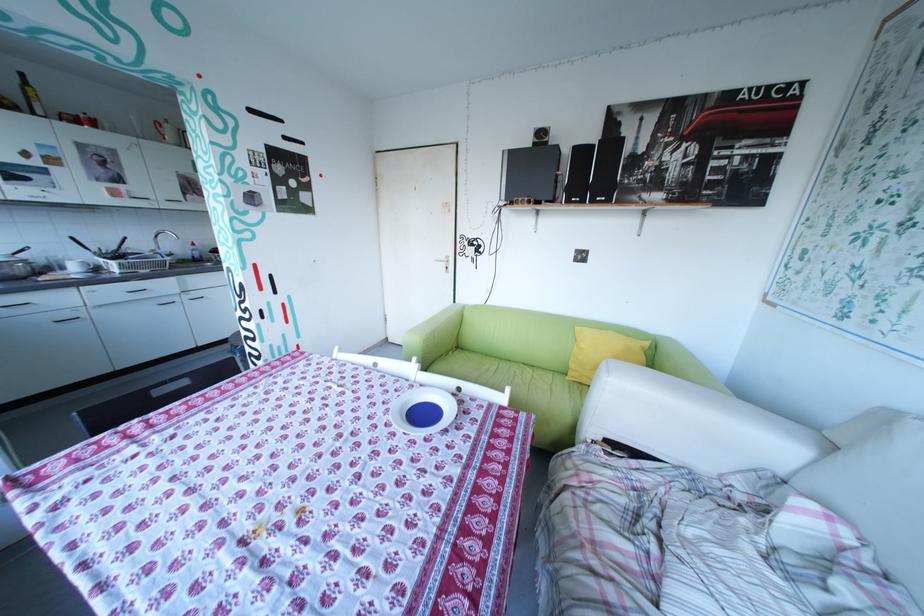
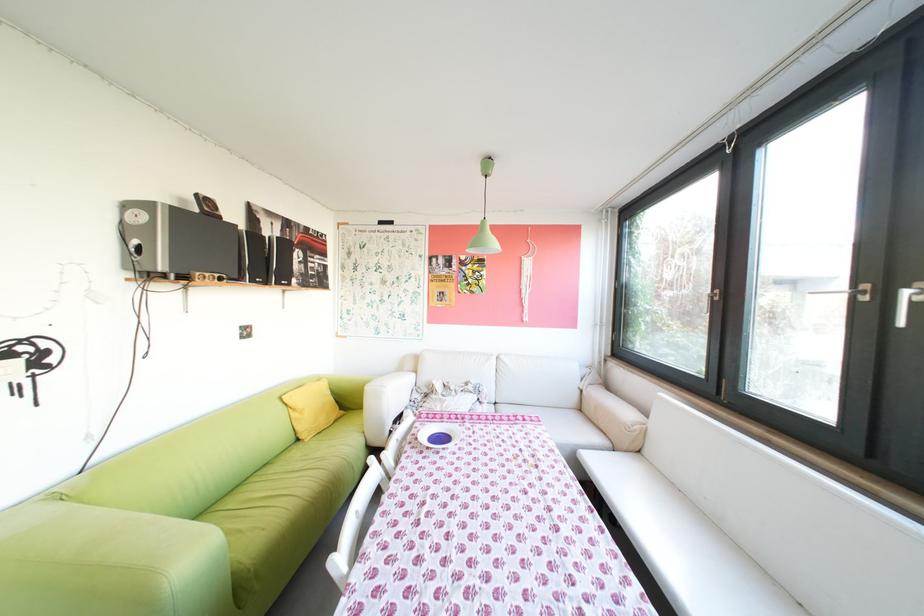
Find the pixel in the second image that matches point 579,378 in the first image.

(321, 440)